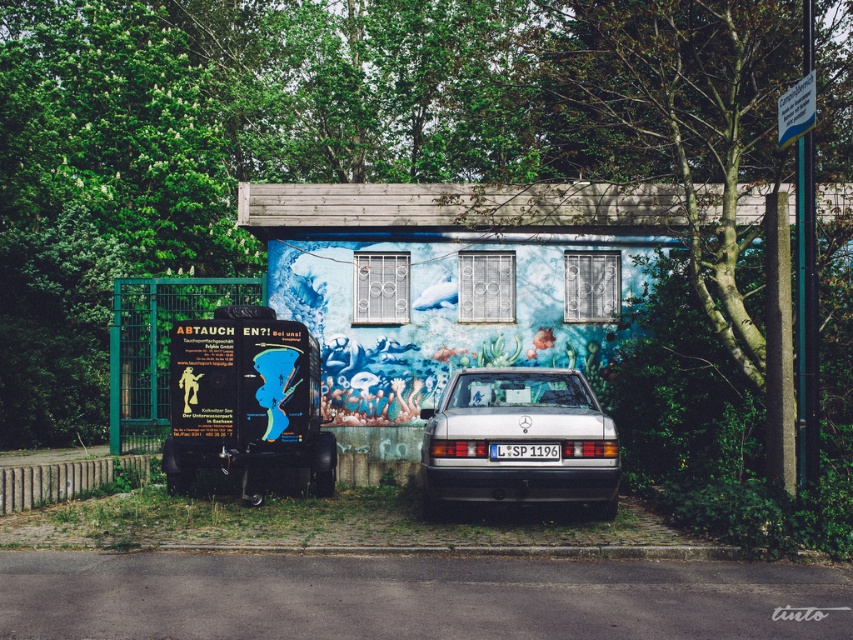
Does silver metallic car at center appear under white plastic license plate at center?

Correct, silver metallic car at center is located below white plastic license plate at center.

The width and height of the screenshot is (853, 640). Describe the element at coordinates (519, 440) in the screenshot. I see `silver metallic car at center` at that location.

At what (x,y) coordinates should I click in order to perform the action: click on silver metallic car at center. Please return your answer as a coordinate pair (x, y). Looking at the image, I should click on (519, 440).